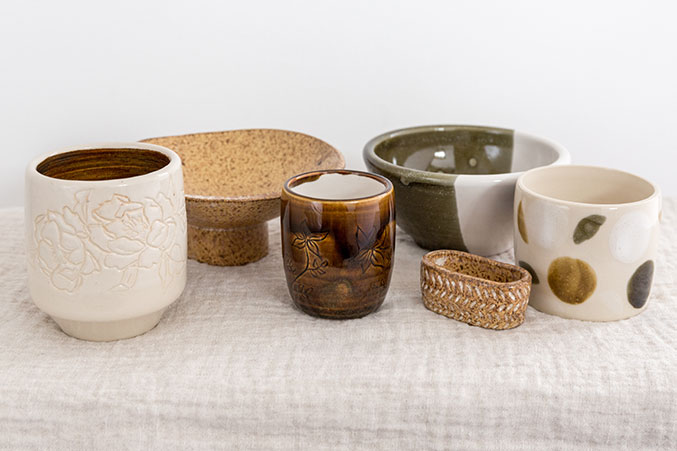
You are a GUI agent. You are given a task and a screenshot of the screen. Output one action in this format:
    pyautogui.click(x=<x>, y=<y>)
    Task: Click on the light brown serving bowl
    Image resolution: width=677 pixels, height=451 pixels.
    Given the screenshot: What is the action you would take?
    pyautogui.click(x=261, y=169)